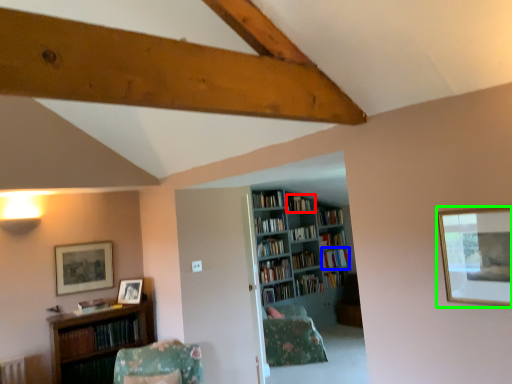
Question: Which object is the closest to the book (highlighted by a red box)? Choose among these: book (highlighted by a blue box) or picture frame (highlighted by a green box).

Choices:
 (A) book
 (B) picture frame

Answer: (A)